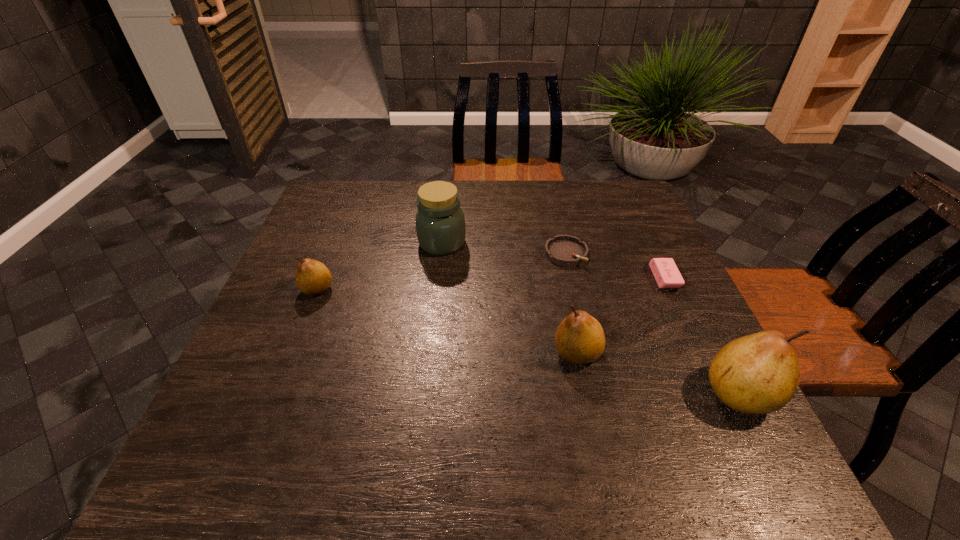
This screenshot has width=960, height=540. I want to click on location for an additional pear to make spacing equal, so click(438, 319).